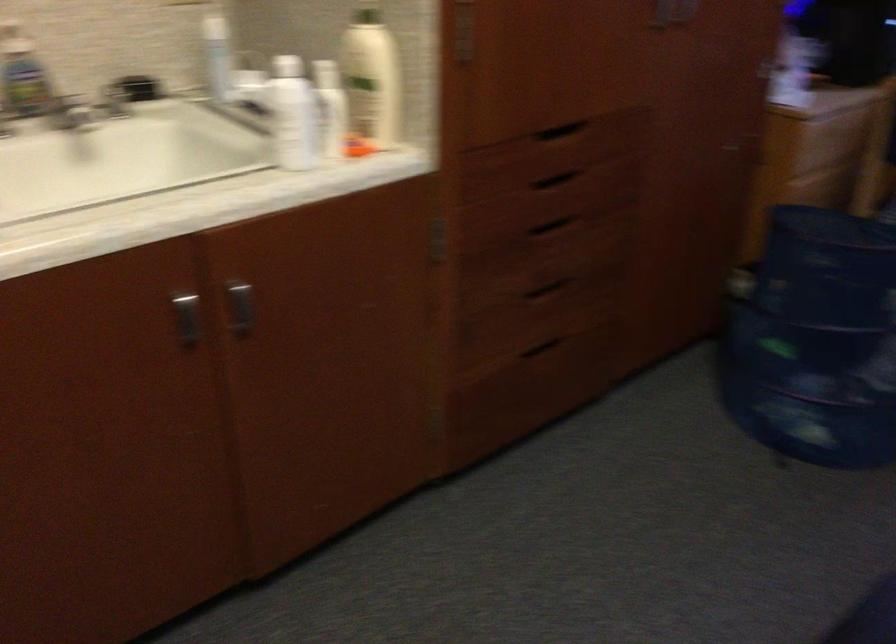
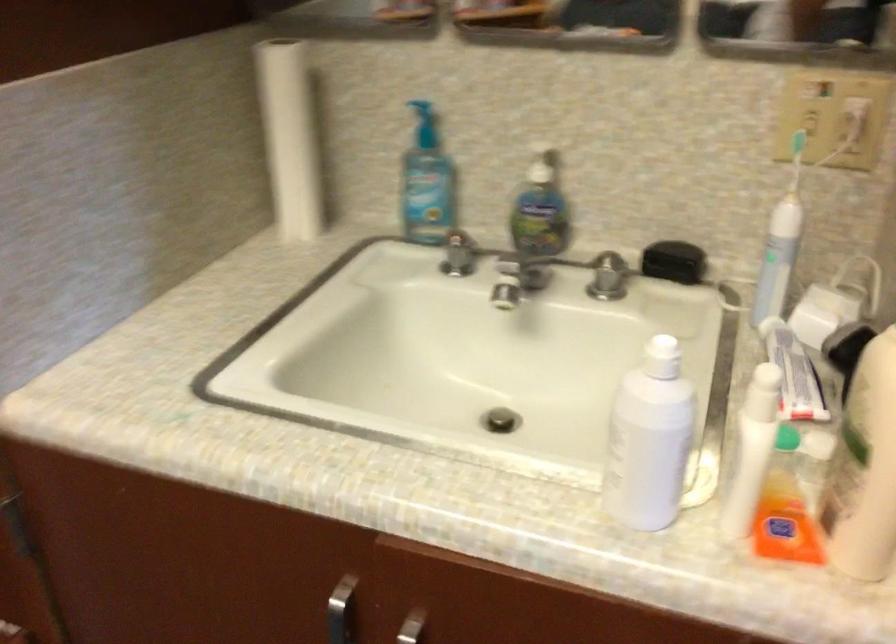
The point at (227,286) is marked in the first image. Where is the corresponding point in the second image?

(411, 627)